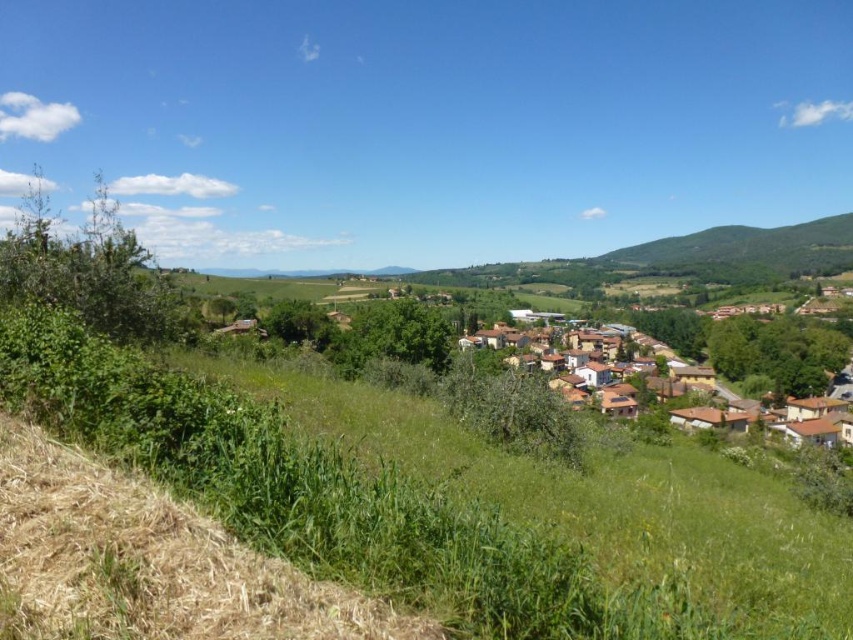
You are a hiker planning to traverse the green grassy hillside at lower left and the green grassy hillside at right. Which hillside would require more time to climb due to its size?

The green grassy hillside at right requires more time to climb because it has a larger size compared to the green grassy hillside at lower left.

You are standing in the middle of the rural landscape and want to walk towards the green grassy hillside at right. Which direction should you go to avoid the green grassy hillside at lower left?

To avoid the green grassy hillside at lower left, you should walk towards the green grassy hillside at right by moving to the right side since the green grassy hillside at lower left is in front of it and located to the left.

You are standing on the green grassy hillside at lower left and want to walk down to the brown tiled roofs at center. Is the path directly below you leading towards the roofs?

The green grassy hillside at lower left is located above the brown tiled roofs at center, so yes, the path directly below you leads towards the brown tiled roofs at center.